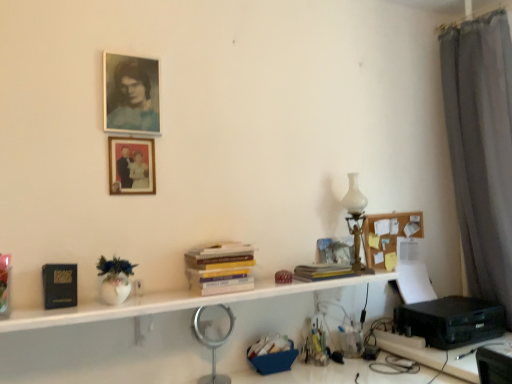
Where is `free space below yellow paper at center, which is the 2th book from left to right (from a real-world perspective)`? The width and height of the screenshot is (512, 384). free space below yellow paper at center, which is the 2th book from left to right (from a real-world perspective) is located at coordinates (328, 280).